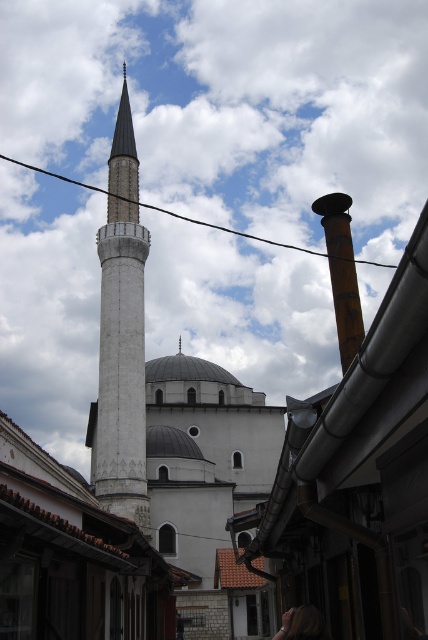
Question: Is the position of white stone minaret at left more distant than that of black wire at upper center?

Choices:
 (A) no
 (B) yes

Answer: (B)

Question: Does white stone minaret at left appear over black wire at upper center?

Choices:
 (A) no
 (B) yes

Answer: (A)

Question: Which of the following is the farthest from the observer?

Choices:
 (A) white stone minaret at left
 (B) black wire at upper center

Answer: (A)

Question: Is the position of white stone minaret at left more distant than that of black wire at upper center?

Choices:
 (A) yes
 (B) no

Answer: (A)

Question: Which of the following is the closest to the observer?

Choices:
 (A) (213, 225)
 (B) (134, 368)

Answer: (B)